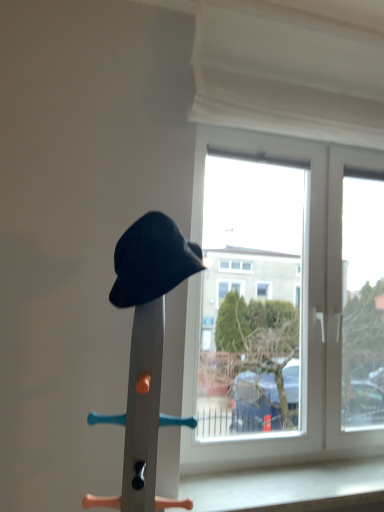
Question: Can we say matte black hat at center lies outside white fabric curtain at upper center?

Choices:
 (A) no
 (B) yes

Answer: (B)

Question: Considering the relative positions of matte black hat at center and white fabric curtain at upper center in the image provided, is matte black hat at center in front of white fabric curtain at upper center?

Choices:
 (A) yes
 (B) no

Answer: (A)

Question: Is matte black hat at center shorter than white fabric curtain at upper center?

Choices:
 (A) no
 (B) yes

Answer: (B)

Question: Does matte black hat at center contain white fabric curtain at upper center?

Choices:
 (A) no
 (B) yes

Answer: (A)

Question: Is matte black hat at center far away from white fabric curtain at upper center?

Choices:
 (A) yes
 (B) no

Answer: (B)

Question: Is transparent glass window at center to the left or to the right of matte black hat at center in the image?

Choices:
 (A) left
 (B) right

Answer: (B)

Question: Does point (208, 129) appear closer or farther from the camera than point (135, 373)?

Choices:
 (A) closer
 (B) farther

Answer: (B)

Question: In terms of width, does transparent glass window at center look wider or thinner when compared to matte black hat at center?

Choices:
 (A) wide
 (B) thin

Answer: (B)

Question: Considering the positions of transparent glass window at center and matte black hat at center in the image, is transparent glass window at center bigger or smaller than matte black hat at center?

Choices:
 (A) big
 (B) small

Answer: (A)

Question: Does point (134, 245) appear closer or farther from the camera than point (271, 58)?

Choices:
 (A) farther
 (B) closer

Answer: (B)

Question: Relative to white fabric curtain at upper center, is matte black hat at center in front or behind?

Choices:
 (A) front
 (B) behind

Answer: (A)

Question: In terms of height, does matte black hat at center look taller or shorter compared to white fabric curtain at upper center?

Choices:
 (A) tall
 (B) short

Answer: (B)

Question: Which is correct: matte black hat at center is inside white fabric curtain at upper center, or outside of it?

Choices:
 (A) outside
 (B) inside

Answer: (A)

Question: Is point (132, 292) closer or farther from the camera than point (170, 259)?

Choices:
 (A) farther
 (B) closer

Answer: (A)

Question: From the image's perspective, is matte black hat at center positioned above or below matte black hat at center?

Choices:
 (A) above
 (B) below

Answer: (B)